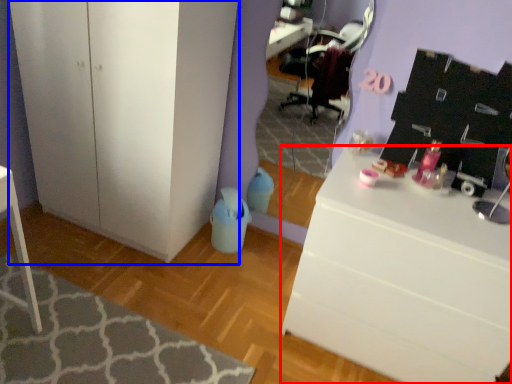
Question: Among these objects, which one is farthest to the camera, desk (highlighted by a red box) or cabinetry (highlighted by a blue box)?

Choices:
 (A) desk
 (B) cabinetry

Answer: (B)